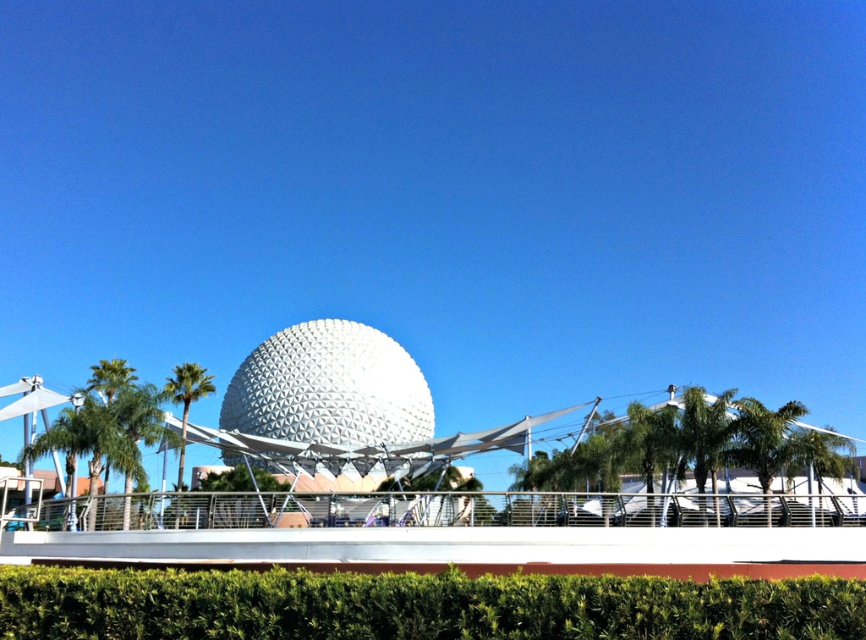
In the scene shown: Is white matte sphere at center bigger than green leafy palm tree at right?

Yes.

How much distance is there between white matte sphere at center and green leafy palm tree at right?

white matte sphere at center is 49.88 meters away from green leafy palm tree at right.

Who is more distant from viewer, (279,353) or (768,518)?

The point (279,353) is more distant.

I want to click on white matte sphere at center, so click(456, 452).

What do you see at coordinates (456, 452) in the screenshot? I see `white matte sphere at center` at bounding box center [456, 452].

Does white matte sphere at center appear under green leafy hedge at lower center?

Actually, white matte sphere at center is above green leafy hedge at lower center.

Which is in front, point (688, 410) or point (204, 608)?

Point (204, 608)

I want to click on white matte sphere at center, so click(x=456, y=452).

Who is shorter, green leafy hedge at lower center or green leafy palm tree at left?

green leafy hedge at lower center

Who is more forward, (74, 586) or (173, 365)?

Point (74, 586) is in front.

Is point (397, 625) farther from viewer compared to point (178, 387)?

No, it is not.

Locate an element on the screen. green leafy hedge at lower center is located at coordinates (417, 605).